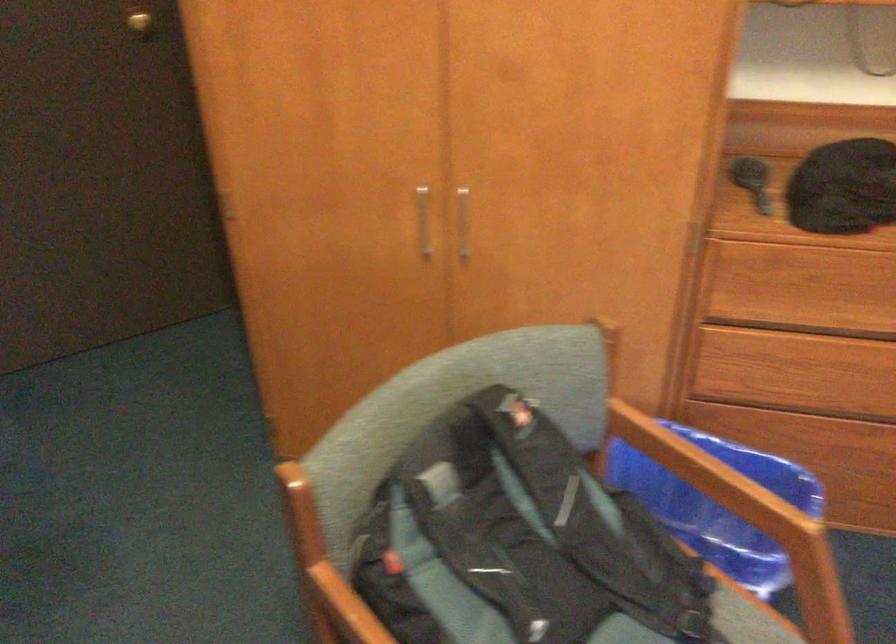
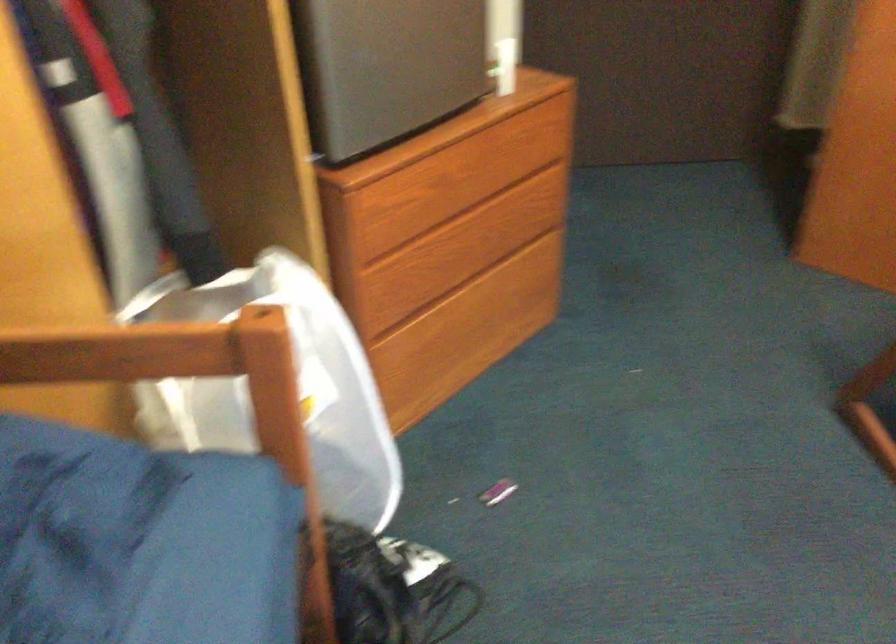
In a continuous first-person perspective shot, in which direction is the camera moving?

The cameraman walked toward left, backward.